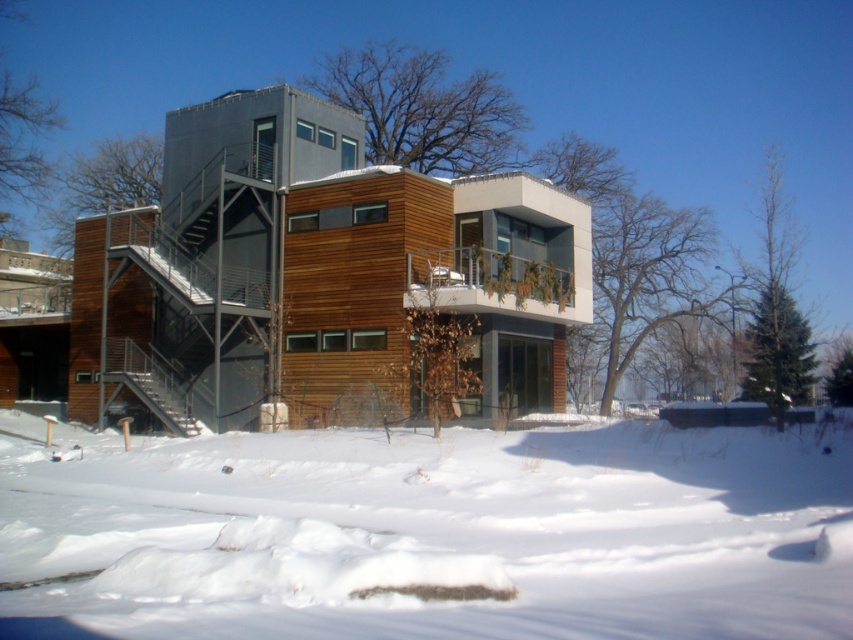
Question: Among these objects, which one is nearest to the camera?

Choices:
 (A) white fluffy snow at lower center
 (B) metallic gray staircase at left

Answer: (A)

Question: Can you confirm if white fluffy snow at lower center is bigger than metallic gray staircase at left?

Choices:
 (A) no
 (B) yes

Answer: (B)

Question: Which point is farther to the camera?

Choices:
 (A) metallic gray staircase at left
 (B) white fluffy snow at lower center

Answer: (A)

Question: Can you confirm if white fluffy snow at lower center is bigger than metallic gray staircase at left?

Choices:
 (A) no
 (B) yes

Answer: (B)

Question: Can you confirm if white fluffy snow at lower center is positioned above metallic gray staircase at left?

Choices:
 (A) no
 (B) yes

Answer: (A)